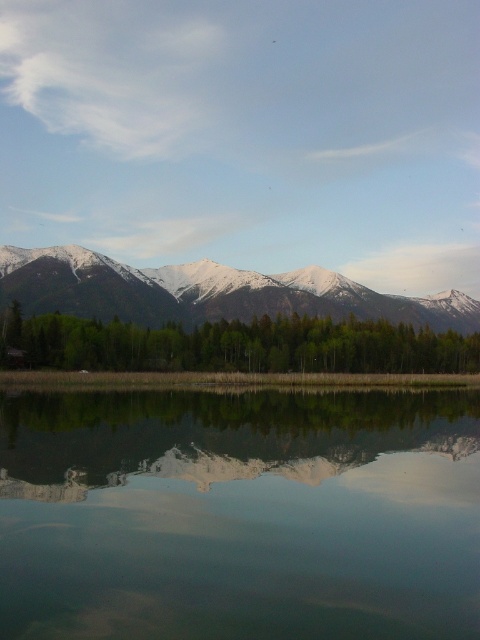
Can you confirm if clear glass water at center is thinner than green matte trees at center?

Correct, clear glass water at center's width is less than green matte trees at center's.

Does point (288, 428) come closer to viewer compared to point (224, 339)?

Yes.

Does point (457, 588) lie in front of point (371, 356)?

Yes.

You are a GUI agent. You are given a task and a screenshot of the screen. Output one action in this format:
    pyautogui.click(x=<x>, y=<y>)
    Task: Click on the clear glass water at center
    The height and width of the screenshot is (640, 480).
    Given the screenshot: What is the action you would take?
    pyautogui.click(x=240, y=513)

Does clear glass water at center have a larger size compared to snowy white mountain range at upper center?

Answer: Incorrect, clear glass water at center is not larger than snowy white mountain range at upper center.

Is clear glass water at center closer to camera compared to snowy white mountain range at upper center?

Yes, clear glass water at center is in front of snowy white mountain range at upper center.

Locate an element on the screen. This screenshot has width=480, height=640. clear glass water at center is located at coordinates (240, 513).

Consider the image. How distant is green matte trees at center from snowy white mountain range at upper center?

green matte trees at center and snowy white mountain range at upper center are 52.71 meters apart.

Between point (272, 369) and point (364, 288), which one is positioned in front?

Positioned in front is point (272, 369).

What are the coordinates of `green matte trees at center` in the screenshot? It's located at (233, 346).